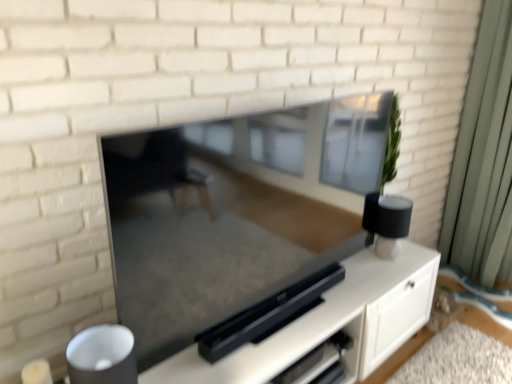
Question: Is satin black entertainment center at center turned away from green fabric curtain at right?

Choices:
 (A) yes
 (B) no

Answer: (B)

Question: Does satin black entertainment center at center turn towards green fabric curtain at right?

Choices:
 (A) no
 (B) yes

Answer: (A)

Question: Is satin black entertainment center at center with green fabric curtain at right?

Choices:
 (A) no
 (B) yes

Answer: (A)

Question: Is green fabric curtain at right a part of satin black entertainment center at center?

Choices:
 (A) no
 (B) yes

Answer: (A)

Question: Would you say satin black entertainment center at center is a long distance from green fabric curtain at right?

Choices:
 (A) no
 (B) yes

Answer: (B)

Question: Is green fabric curtain at right wider or thinner than matte black tv at center?

Choices:
 (A) thin
 (B) wide

Answer: (B)

Question: Which is correct: green fabric curtain at right is inside matte black tv at center, or outside of it?

Choices:
 (A) inside
 (B) outside

Answer: (B)

Question: Considering the positions of green fabric curtain at right and matte black tv at center in the image, is green fabric curtain at right taller or shorter than matte black tv at center?

Choices:
 (A) tall
 (B) short

Answer: (A)

Question: Is green fabric curtain at right to the left or to the right of matte black tv at center in the image?

Choices:
 (A) left
 (B) right

Answer: (B)

Question: From a real-world perspective, is matte black tv at center above or below green fabric curtain at right?

Choices:
 (A) above
 (B) below

Answer: (A)

Question: In terms of width, does matte black tv at center look wider or thinner when compared to green fabric curtain at right?

Choices:
 (A) thin
 (B) wide

Answer: (A)

Question: Is matte black tv at center taller or shorter than green fabric curtain at right?

Choices:
 (A) tall
 (B) short

Answer: (B)

Question: Is point (201, 307) closer or farther from the camera than point (508, 34)?

Choices:
 (A) farther
 (B) closer

Answer: (B)

Question: Considering the positions of satin black entertainment center at center and green fabric curtain at right in the image, is satin black entertainment center at center bigger or smaller than green fabric curtain at right?

Choices:
 (A) small
 (B) big

Answer: (B)

Question: Considering their positions, is satin black entertainment center at center located in front of or behind green fabric curtain at right?

Choices:
 (A) behind
 (B) front

Answer: (B)